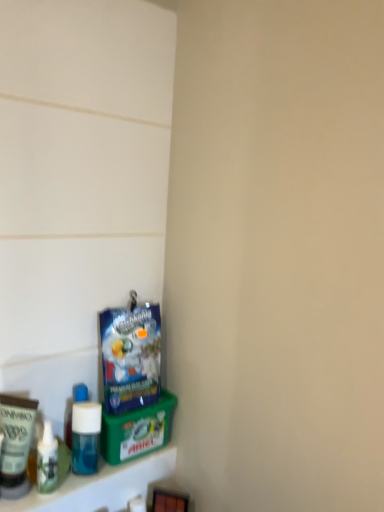
Question: From a real-world perspective, is blue plastic bag at lower left positioned under blue matte bottle at lower left based on gravity?

Choices:
 (A) yes
 (B) no

Answer: (B)

Question: Is blue plastic bag at lower left taller than blue matte bottle at lower left?

Choices:
 (A) yes
 (B) no

Answer: (A)

Question: From the image's perspective, does blue plastic bag at lower left appear lower than blue matte bottle at lower left?

Choices:
 (A) no
 (B) yes

Answer: (A)

Question: Can you confirm if blue plastic bag at lower left is thinner than blue matte bottle at lower left?

Choices:
 (A) no
 (B) yes

Answer: (B)

Question: From the image's perspective, would you say blue plastic bag at lower left is positioned over blue matte bottle at lower left?

Choices:
 (A) yes
 (B) no

Answer: (A)

Question: Is blue matte bottle at lower left bigger or smaller than blue plastic bag at lower left?

Choices:
 (A) small
 (B) big

Answer: (A)

Question: Is point (89, 410) positioned closer to the camera than point (144, 386)?

Choices:
 (A) farther
 (B) closer

Answer: (B)

Question: Is blue matte bottle at lower left to the left or to the right of blue plastic bag at lower left in the image?

Choices:
 (A) left
 (B) right

Answer: (A)

Question: In the image, is blue matte bottle at lower left positioned in front of or behind blue plastic bag at lower left?

Choices:
 (A) behind
 (B) front

Answer: (B)

Question: Visually, is matte cream tube at lower left, the 2th toiletry positioned from the right, positioned to the left or to the right of blue plastic bag at lower left?

Choices:
 (A) left
 (B) right

Answer: (A)

Question: In terms of width, does matte cream tube at lower left, the 2th toiletry positioned from the right, look wider or thinner when compared to blue plastic bag at lower left?

Choices:
 (A) wide
 (B) thin

Answer: (B)

Question: Is point (9, 402) closer or farther from the camera than point (144, 310)?

Choices:
 (A) closer
 (B) farther

Answer: (A)

Question: From the image's perspective, is matte cream tube at lower left, the 2th toiletry positioned from the right, above or below blue plastic bag at lower left?

Choices:
 (A) below
 (B) above

Answer: (A)

Question: Is point (86, 437) closer or farther from the camera than point (1, 415)?

Choices:
 (A) closer
 (B) farther

Answer: (B)

Question: From a real-world perspective, is blue matte bottle at lower left above or below matte cream tube at lower left, the 2th toiletry positioned from the right?

Choices:
 (A) above
 (B) below

Answer: (B)